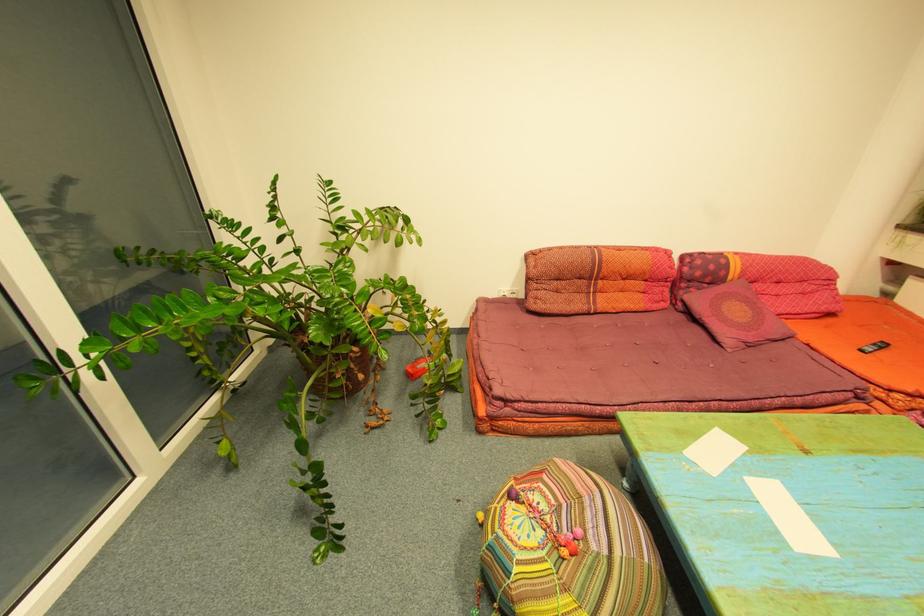
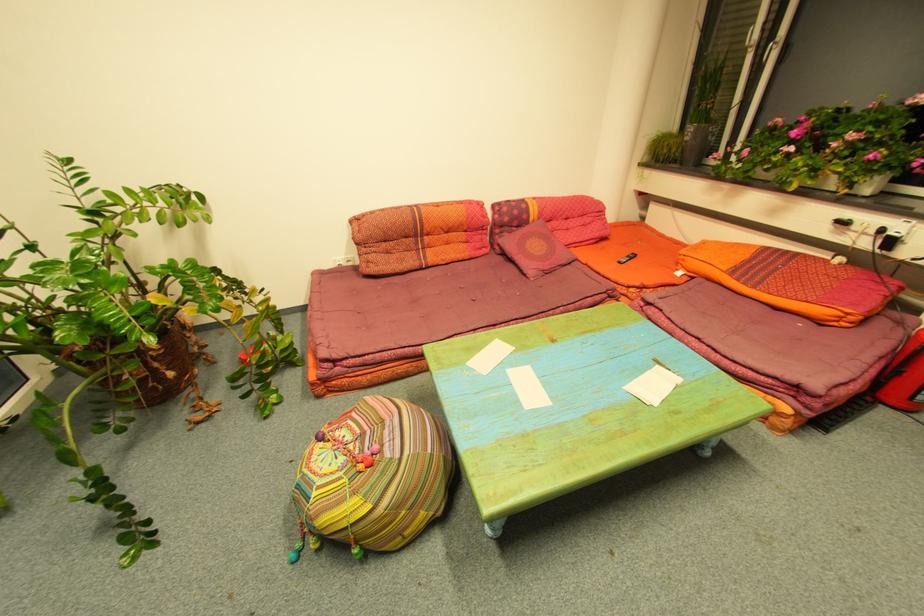
Which direction would the cameraman need to move to produce the second image?

The movement direction of the cameraman is right, backward.